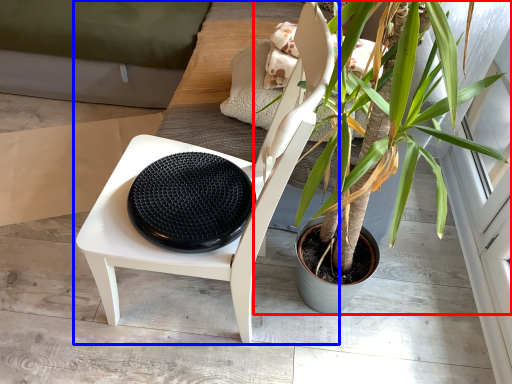
Question: Which of the following is the closest to the observer, houseplant (highlighted by a red box) or chair (highlighted by a blue box)?

Choices:
 (A) houseplant
 (B) chair

Answer: (B)